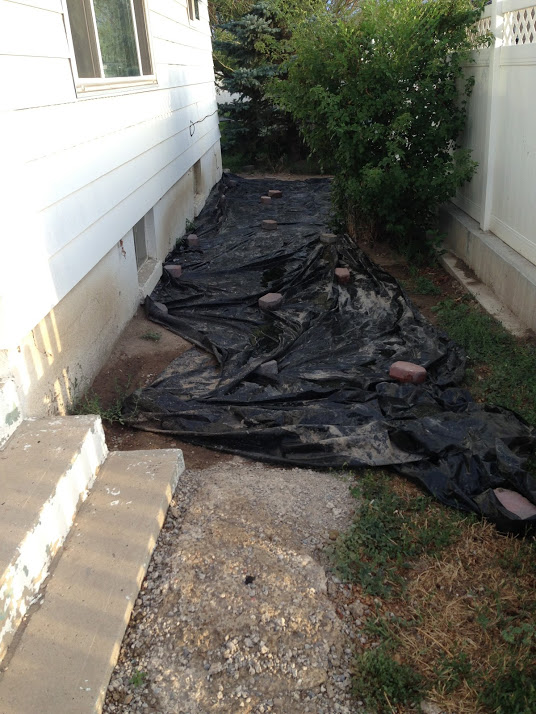
Locate an element on the screen. house window is located at coordinates (121, 46), (196, 16).